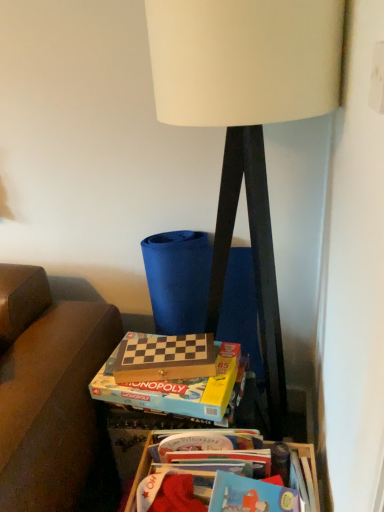
Where is `vacant area that is in front of wooden chess set at lower center, which appears as the first paperback book when viewed from the back`? The height and width of the screenshot is (512, 384). vacant area that is in front of wooden chess set at lower center, which appears as the first paperback book when viewed from the back is located at coordinates (170, 389).